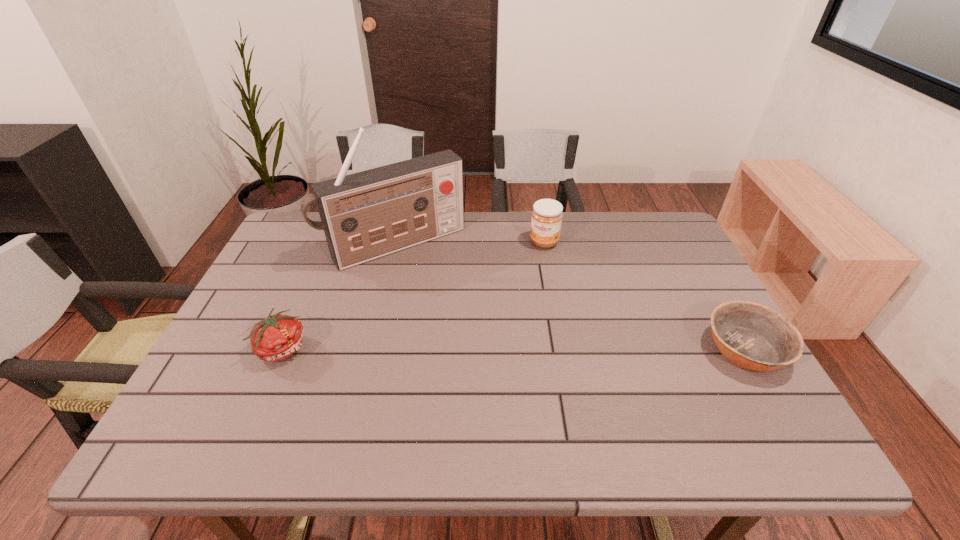
Identify the location of object that is the second closest one to the tallest object. (276, 338).

At what (x,y) coordinates should I click in order to perform the action: click on vacant area that satisfies the following two spatial constraints: 1. on the back side of the tallest object; 2. on the left side of the jam. Please return your answer as a coordinate pair (x, y). The width and height of the screenshot is (960, 540). Looking at the image, I should click on (396, 242).